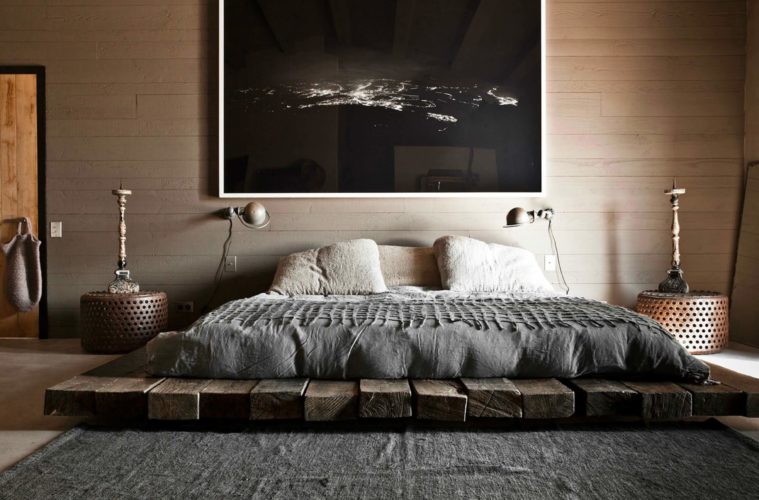
Find the location of `pillow`. pillow is located at coordinates (345, 269).